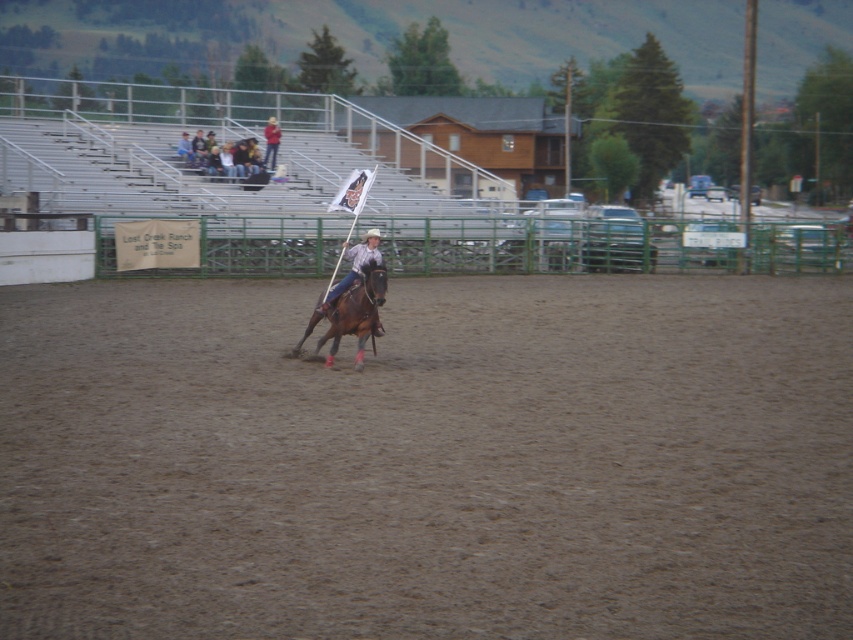
Does brown glossy horse at center appear over denim jacket at upper left?

Actually, brown glossy horse at center is below denim jacket at upper left.

The height and width of the screenshot is (640, 853). What do you see at coordinates (350, 316) in the screenshot?
I see `brown glossy horse at center` at bounding box center [350, 316].

Where is `brown glossy horse at center`? brown glossy horse at center is located at coordinates (350, 316).

Is matte brown horse at center to the right of light brown leather jacket at upper center from the viewer's perspective?

Correct, you'll find matte brown horse at center to the right of light brown leather jacket at upper center.

Can you confirm if matte brown horse at center is wider than light brown leather jacket at upper center?

No, matte brown horse at center is not wider than light brown leather jacket at upper center.

What do you see at coordinates (354, 266) in the screenshot?
I see `matte brown horse at center` at bounding box center [354, 266].

The height and width of the screenshot is (640, 853). Identify the location of matte brown horse at center. (354, 266).

Is brown sandy dirt at center to the left of matte brown horse at center from the viewer's perspective?

In fact, brown sandy dirt at center is to the right of matte brown horse at center.

Is brown sandy dirt at center above matte brown horse at center?

Incorrect, brown sandy dirt at center is not positioned above matte brown horse at center.

Who is more forward, (26, 442) or (357, 244)?

Positioned in front is point (26, 442).

At what (x,y) coordinates should I click in order to perform the action: click on brown sandy dirt at center. Please return your answer as a coordinate pair (x, y). Looking at the image, I should click on (428, 460).